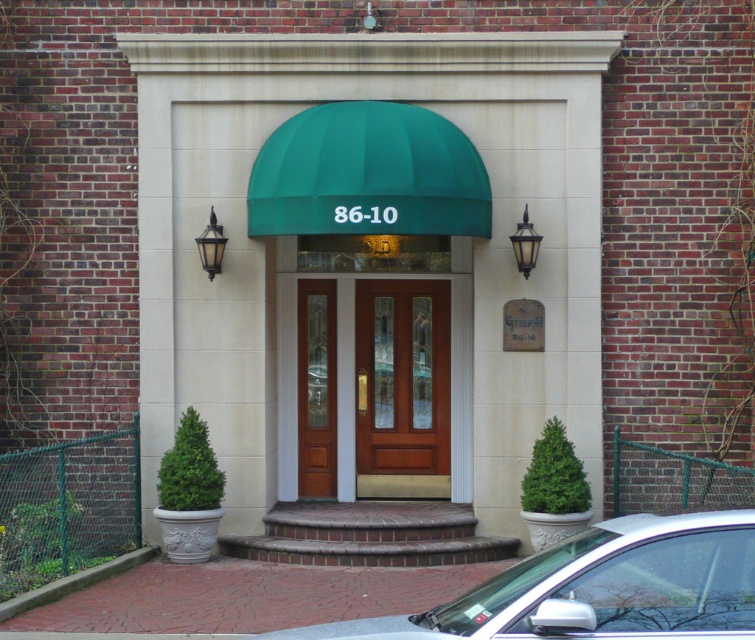
Question: Is white glossy car at lower center further to camera compared to brown wood door at center?

Choices:
 (A) yes
 (B) no

Answer: (B)

Question: Considering the relative positions of white glossy car at lower center and mahogany wood door at center in the image provided, where is white glossy car at lower center located with respect to mahogany wood door at center?

Choices:
 (A) below
 (B) above

Answer: (A)

Question: Does mahogany wood door at center appear over brown wood door at center?

Choices:
 (A) yes
 (B) no

Answer: (B)

Question: Which of the following is the closest to the observer?

Choices:
 (A) mahogany wood door at center
 (B) white glossy car at lower center

Answer: (B)

Question: Estimate the real-world distances between objects in this image. Which object is closer to the mahogany wood door at center?

Choices:
 (A) white glossy car at lower center
 (B) brown wood door at center

Answer: (B)

Question: Which point is farther from the camera taking this photo?

Choices:
 (A) (319, 292)
 (B) (686, 595)
 (C) (384, 346)

Answer: (C)